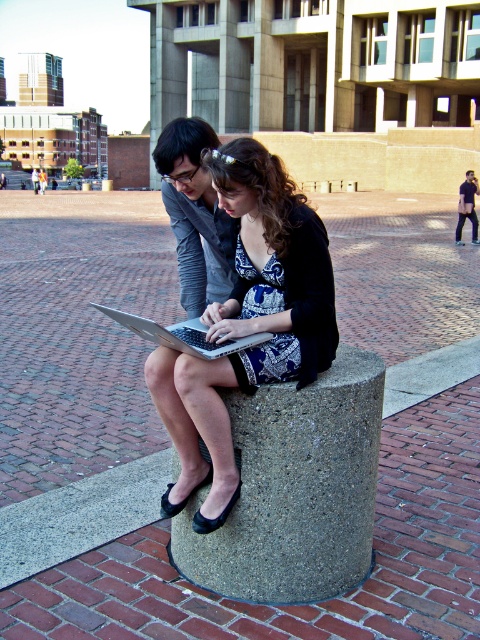
You are a photographer trying to capture a closeup of the patterned fabric dress at center while avoiding the gray concrete at center. Based on their positions, which object is closer to you and would block the view of the dress?

The gray concrete at center is closer to you than the patterned fabric dress at center, so it would block the view of the dress.

You are a photographer trying to capture a candid shot of the two people sitting on the concrete structure. You want to ensure both the patterned fabric dress at center and the silver metallic laptop at center are clearly visible in the photo. Given their positions, which object should you focus on first to ensure both are in focus?

The silver metallic laptop at center is behind the patterned fabric dress at center. To ensure both are in focus, you should focus on the silver metallic laptop at center first since it is farther away, allowing the dress in front to remain sharp as well.

You are standing in the plaza and want to reach the point marked as point (316, 234). If you take a step forward, will you be closer to or farther from the point?

The point (316, 234) is 2.68 meters from the viewer. Taking a step forward would decrease the distance, so you would be closer to the point.